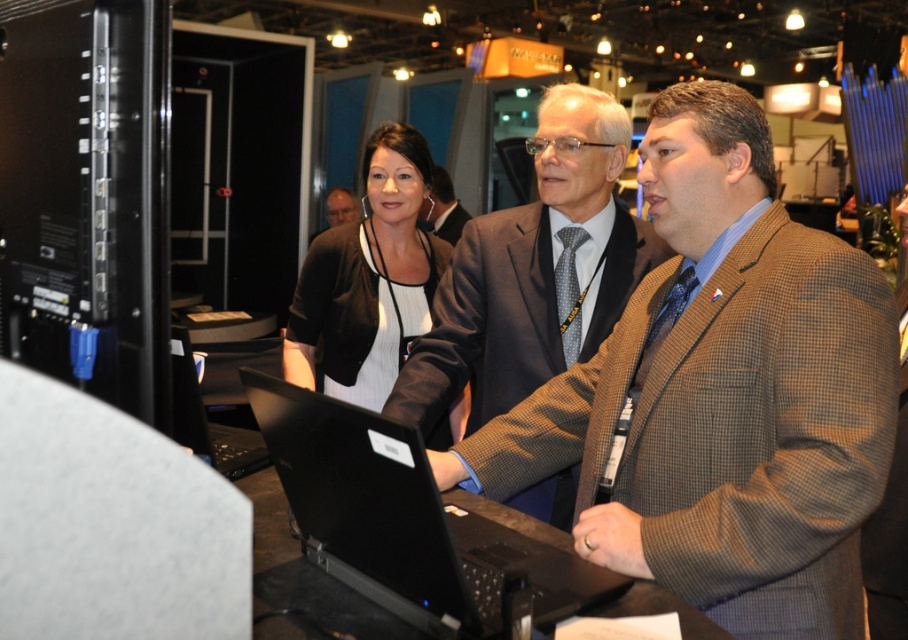
Question: Observing the image, what is the correct spatial positioning of black glossy laptop at center in reference to matte black laptop at center?

Choices:
 (A) above
 (B) below

Answer: (A)

Question: Does brown wool suit at center have a greater width compared to matte black laptop at center?

Choices:
 (A) no
 (B) yes

Answer: (B)

Question: Which point is closer to the camera?

Choices:
 (A) (851, 508)
 (B) (601, 538)

Answer: (A)

Question: Does brown checkered blazer at center appear over matte black laptop at center?

Choices:
 (A) yes
 (B) no

Answer: (A)

Question: Which object is the closest to the black glossy laptop at center?

Choices:
 (A) brown wool suit at center
 (B) brown checkered suit at center
 (C) matte black laptop at center

Answer: (C)

Question: Considering the real-world distances, which object is farthest from the matte black laptop at center?

Choices:
 (A) matte black blazer at center
 (B) black matte laptop at center
 (C) brown wool suit at center

Answer: (C)